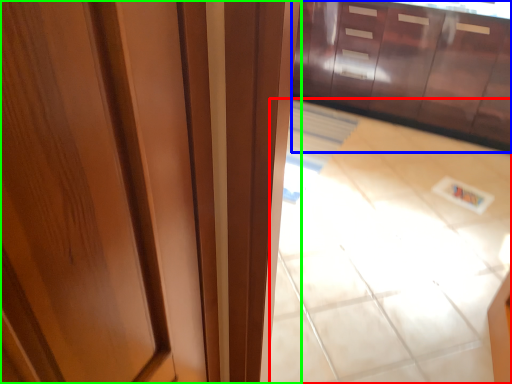
Question: Considering the real-world distances, which object is farthest from tile (highlighted by a red box)? cabinetry (highlighted by a blue box) or door (highlighted by a green box)?

Choices:
 (A) cabinetry
 (B) door

Answer: (B)